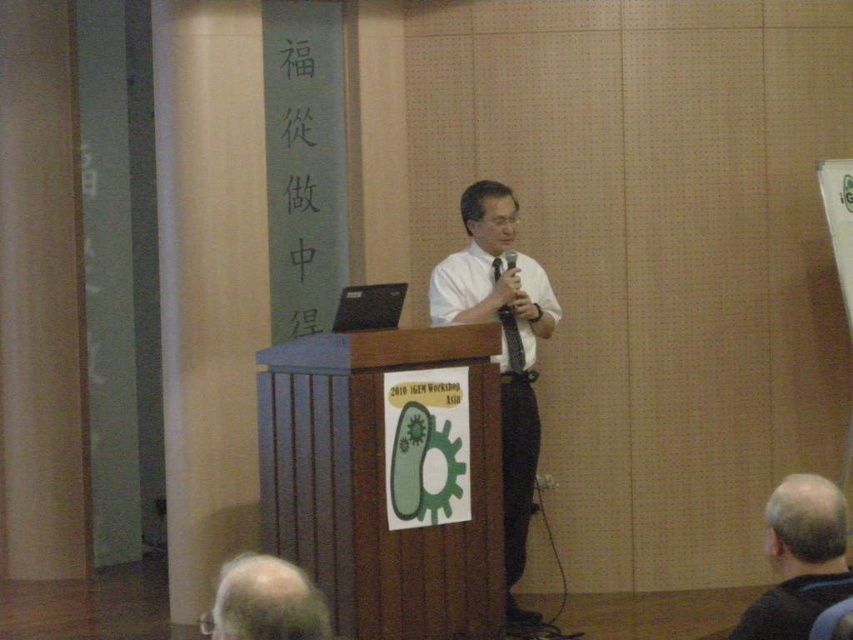
Can you confirm if gray hair at lower right is shorter than gray hair at lower left?

No.

Can you confirm if gray hair at lower right is positioned below gray hair at lower left?

Incorrect, gray hair at lower right is not positioned below gray hair at lower left.

Locate an element on the screen. gray hair at lower right is located at coordinates (799, 560).

Is white glossy shirt at center shorter than gray hair at lower right?

No.

Looking at this image, which is more to the right, white glossy shirt at center or gray hair at lower right?

gray hair at lower right

Does point (509, 602) lie behind point (827, 531)?

Yes, it is.

I want to click on white glossy shirt at center, so click(x=502, y=348).

Is gray hair at lower left smaller than black fabric microphone at center?

Actually, gray hair at lower left might be larger than black fabric microphone at center.

Does gray hair at lower left have a lesser width compared to black fabric microphone at center?

In fact, gray hair at lower left might be wider than black fabric microphone at center.

Is point (287, 588) behind point (509, 252)?

No, (287, 588) is in front of (509, 252).

At what (x,y) coordinates should I click in order to perform the action: click on gray hair at lower left. Please return your answer as a coordinate pair (x, y). This screenshot has width=853, height=640. Looking at the image, I should click on (265, 602).